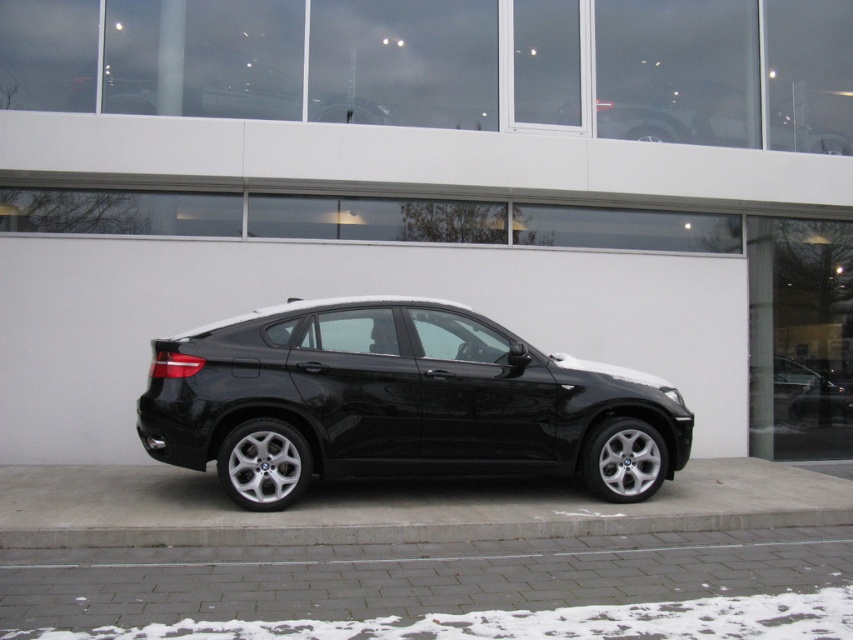
Question: Which of the following is the closest to the observer?

Choices:
 (A) (650, 554)
 (B) (459, 388)
 (C) (697, 520)

Answer: (A)

Question: Which point is farther to the camera?

Choices:
 (A) gray brick pavement at lower center
 (B) black metallic car at center
 (C) concrete at lower center

Answer: (B)

Question: Is gray brick pavement at lower center below concrete at lower center?

Choices:
 (A) yes
 (B) no

Answer: (A)

Question: Is gray brick pavement at lower center smaller than concrete at lower center?

Choices:
 (A) yes
 (B) no

Answer: (B)

Question: Can you confirm if gray brick pavement at lower center is wider than concrete at lower center?

Choices:
 (A) no
 (B) yes

Answer: (B)

Question: Which point is farther to the camera?

Choices:
 (A) concrete at lower center
 (B) black metallic car at center
 (C) gray brick pavement at lower center

Answer: (B)